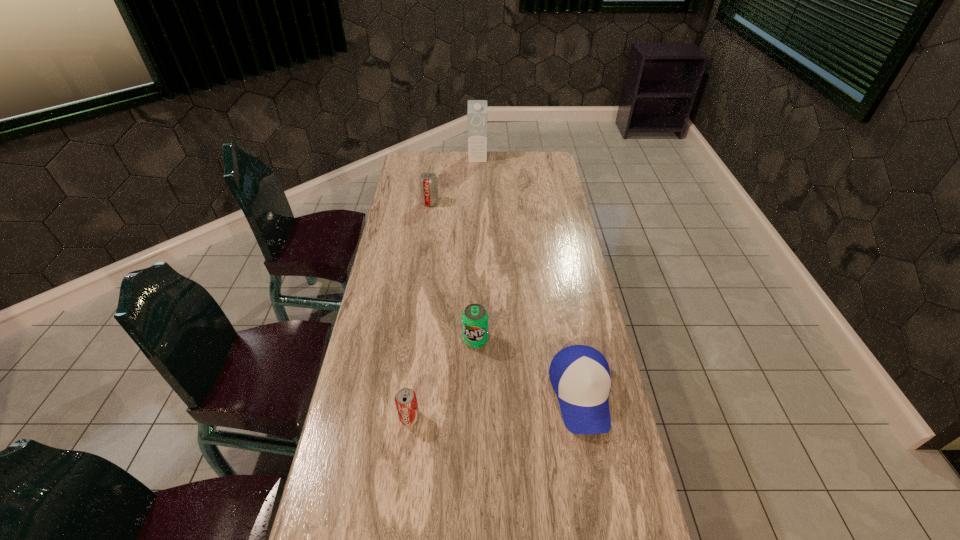
Where is `soda can object that ranks as the second closest to the rightmost soda can`? Image resolution: width=960 pixels, height=540 pixels. soda can object that ranks as the second closest to the rightmost soda can is located at coordinates (428, 181).

Locate an element on the screen. This screenshot has height=540, width=960. soda can that stands as the third closest to the carton is located at coordinates point(406,403).